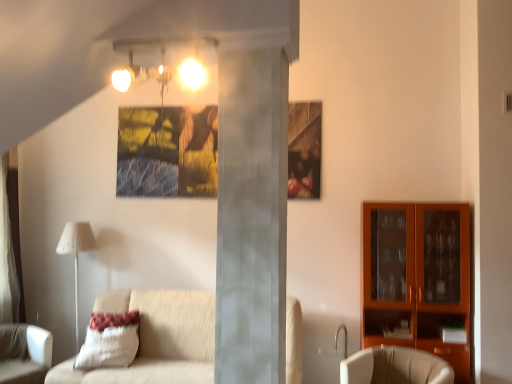
Question: Considering the positions of white fabric chair at lower left, arranged as the first chair when viewed from the left, and white textured pillow at lower left in the image, is white fabric chair at lower left, arranged as the first chair when viewed from the left, wider or thinner than white textured pillow at lower left?

Choices:
 (A) thin
 (B) wide

Answer: (B)

Question: Would you say white fabric chair at lower left, arranged as the first chair when viewed from the left, is inside or outside white textured pillow at lower left?

Choices:
 (A) outside
 (B) inside

Answer: (A)

Question: Estimate the real-world distances between objects in this image. Which object is farther from the white fabric lampshade at left?

Choices:
 (A) beige fabric chair at lower right, which appears as the 1th chair when viewed from the right
 (B) white textured pillow at lower left
 (C) matte orange cabinet at right
 (D) white fabric chair at lower left, arranged as the first chair when viewed from the left
 (E) matte glass light fixture at upper center

Answer: (E)

Question: Which of these objects is positioned closest to the matte orange cabinet at right?

Choices:
 (A) white fabric lampshade at left
 (B) white fabric curtain at left
 (C) white textured pillow at lower left
 (D) matte glass light fixture at upper center
 (E) white fabric chair at lower left, arranged as the first chair when viewed from the left

Answer: (C)